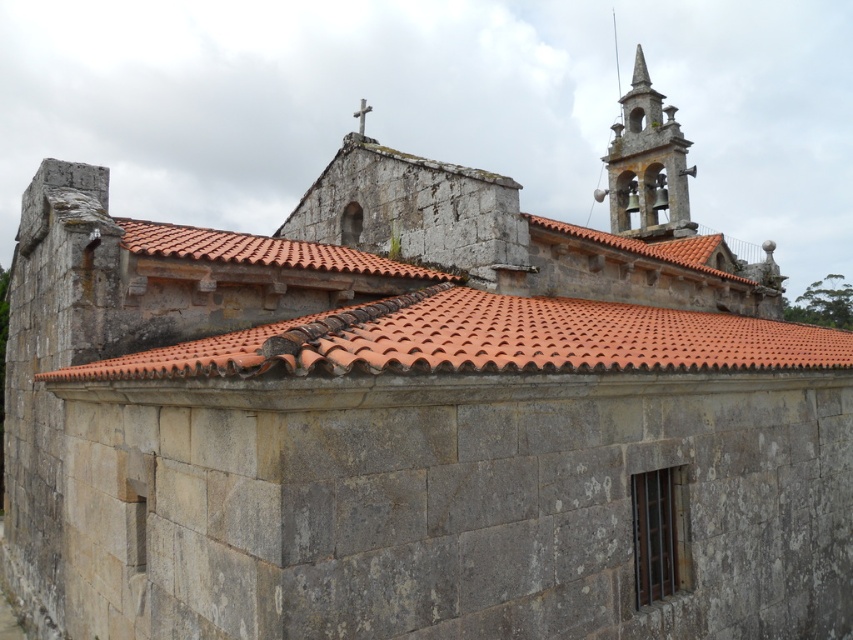
Does orange clay tiles at center have a lesser height compared to stone bell tower at upper right?

Indeed, orange clay tiles at center has a lesser height compared to stone bell tower at upper right.

Between orange clay tiles at center and stone bell tower at upper right, which one has more height?

stone bell tower at upper right

Does point (514, 308) come farther from viewer compared to point (688, 209)?

No, it is in front of (688, 209).

Find the location of a particular element. The image size is (853, 640). orange clay tiles at center is located at coordinates (486, 340).